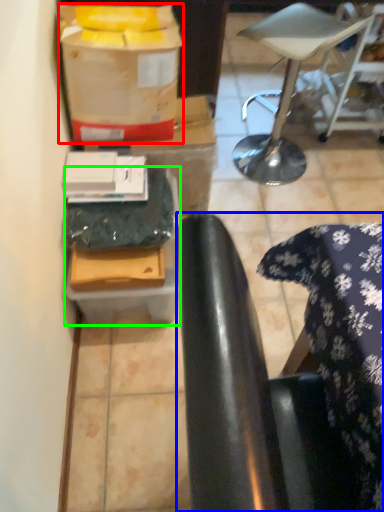
Question: Which object is the closest to the wrapping paper (highlighted by a red box)? Choose among these: chair (highlighted by a blue box) or cardboard box (highlighted by a green box).

Choices:
 (A) chair
 (B) cardboard box

Answer: (B)